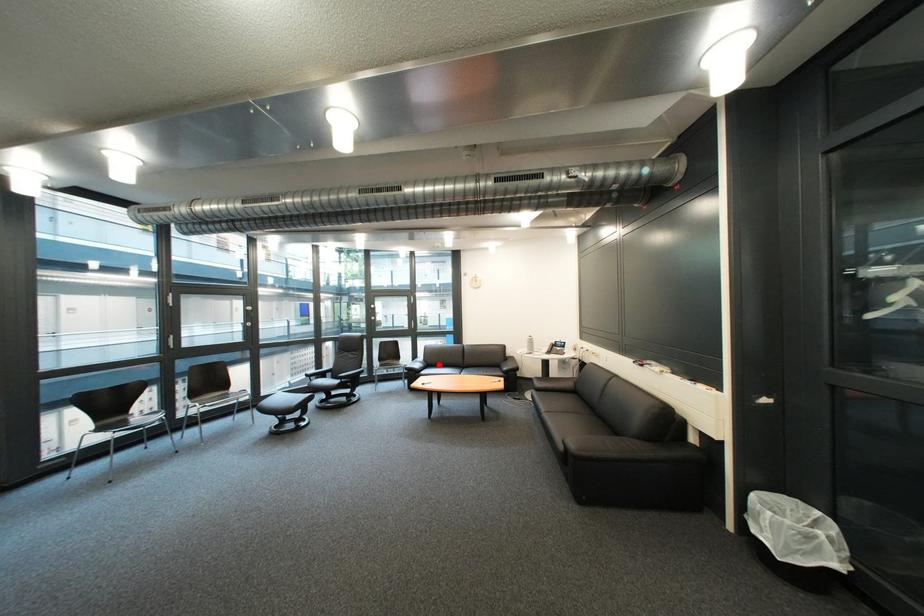
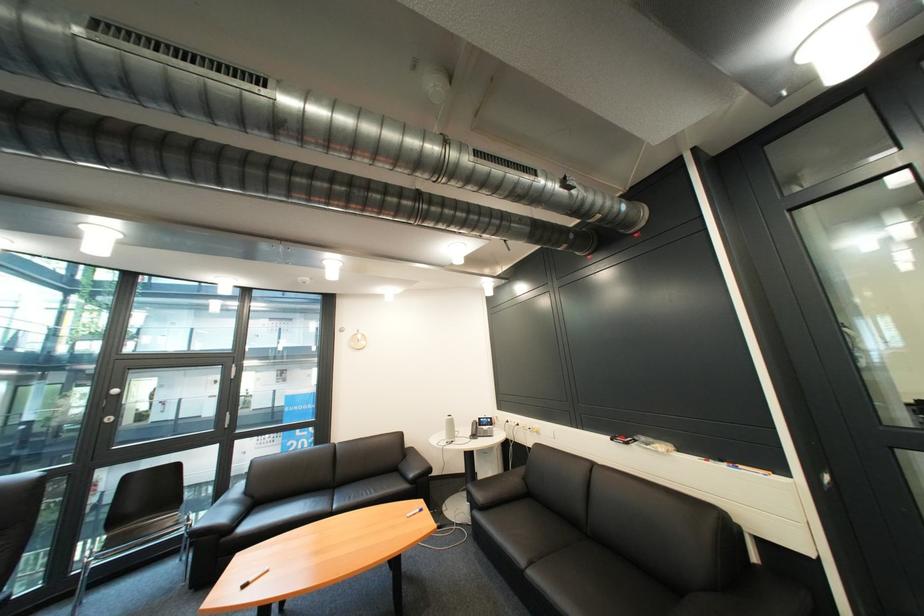
Find the pixel in the second image that matches the highlighted location in the first image.

(262, 503)